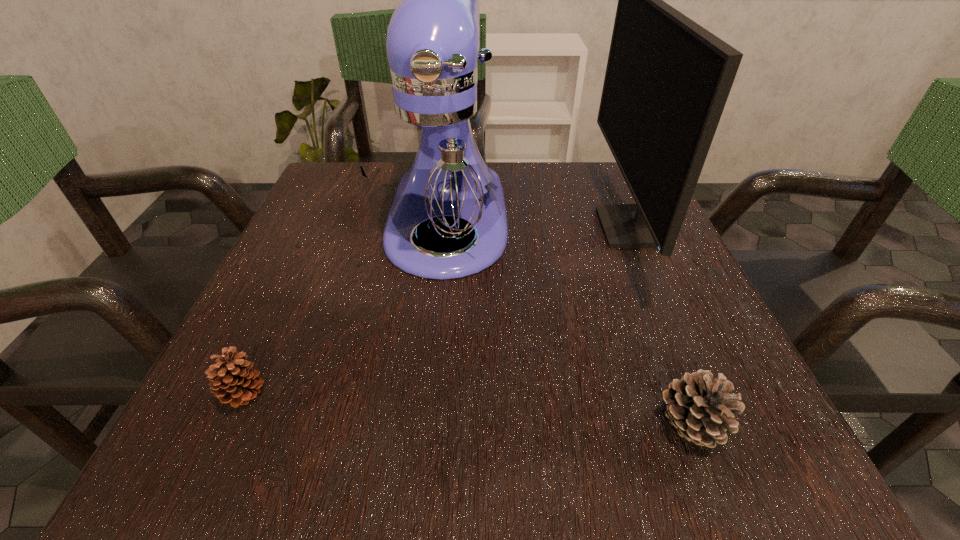
The width and height of the screenshot is (960, 540). Find the location of `vacant space at the left edge of the desktop`. vacant space at the left edge of the desktop is located at coordinates (319, 376).

I want to click on free space at the right edge of the desktop, so 635,268.

Identify the location of vacant region at the near left corner of the desktop. (253, 424).

This screenshot has width=960, height=540. In the image, there is a desktop. Find the location of `blank space at the far right corner`. blank space at the far right corner is located at coordinates click(x=587, y=205).

At what (x,y) coordinates should I click in order to perform the action: click on empty space between the right pinecone and the computer monitor. Please return your answer as a coordinate pair (x, y). Looking at the image, I should click on (660, 326).

Image resolution: width=960 pixels, height=540 pixels. Identify the location of empty location between the computer monitor and the left pinecone. (438, 312).

You are a GUI agent. You are given a task and a screenshot of the screen. Output one action in this format:
    pyautogui.click(x=<x>, y=<y>)
    Task: Click on the free space between the leftmost object and the computer monitor
    The height and width of the screenshot is (540, 960).
    Given the screenshot: What is the action you would take?
    pyautogui.click(x=438, y=312)

Locate an element on the screen. This screenshot has width=960, height=540. empty space between the right pinecone and the computer monitor is located at coordinates (660, 326).

Locate an element on the screen. The width and height of the screenshot is (960, 540). vacant region between the right pinecone and the leftmost object is located at coordinates (468, 410).

Locate an element on the screen. This screenshot has height=540, width=960. free space between the mixer and the right pinecone is located at coordinates (569, 322).